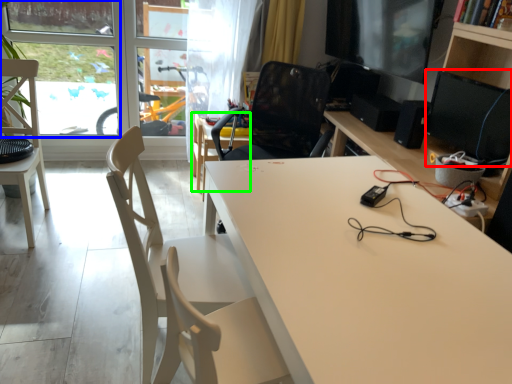
Question: Based on their relative distances, which object is farther from computer monitor (highlighted by a red box)? Choose from window screen (highlighted by a blue box) and table (highlighted by a green box).

Choices:
 (A) window screen
 (B) table

Answer: (A)